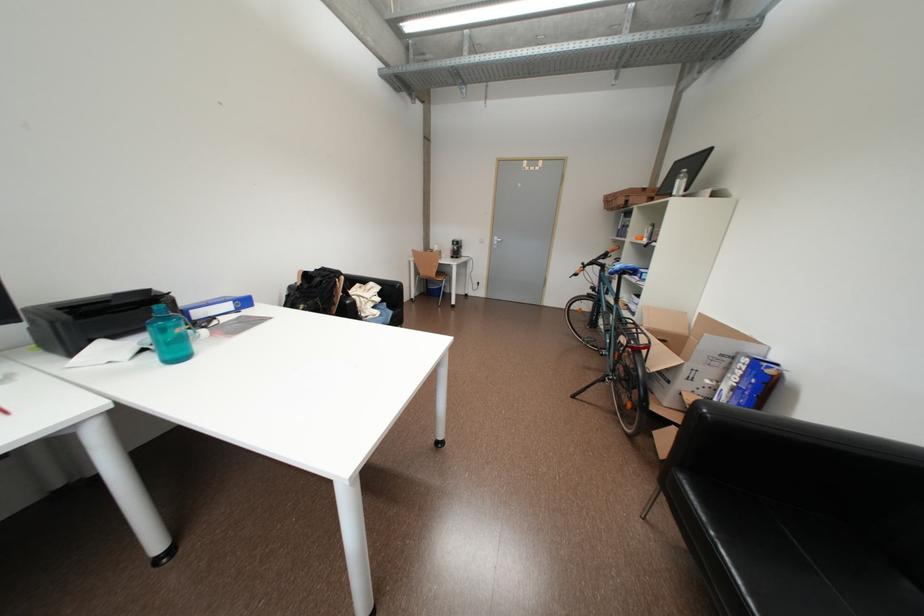
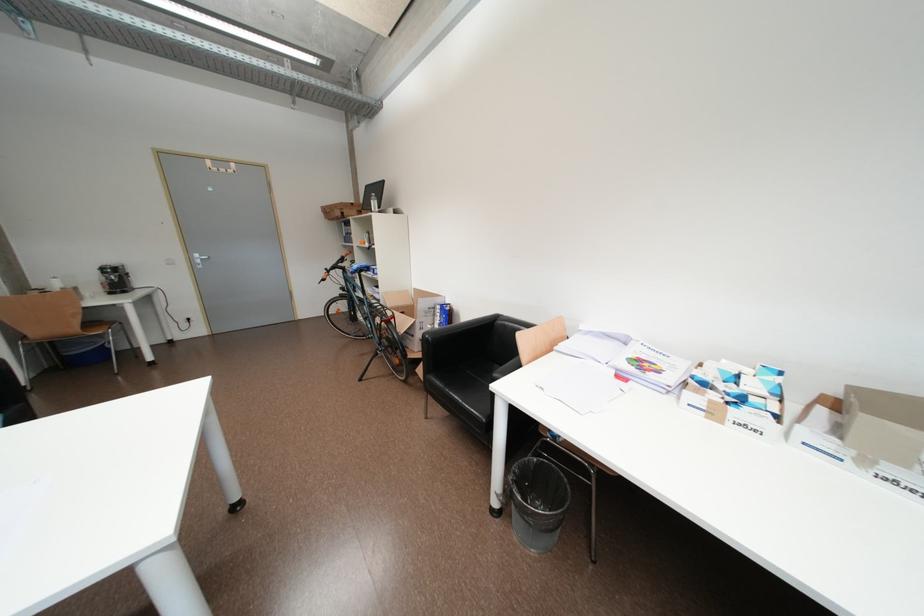
Question: The camera is either moving clockwise (left) or counter-clockwise (right) around the object. The first image is from the beginning of the video and the second image is from the end. Is the camera moving left or right when shooting the video?

Choices:
 (A) Left
 (B) Right

Answer: (A)